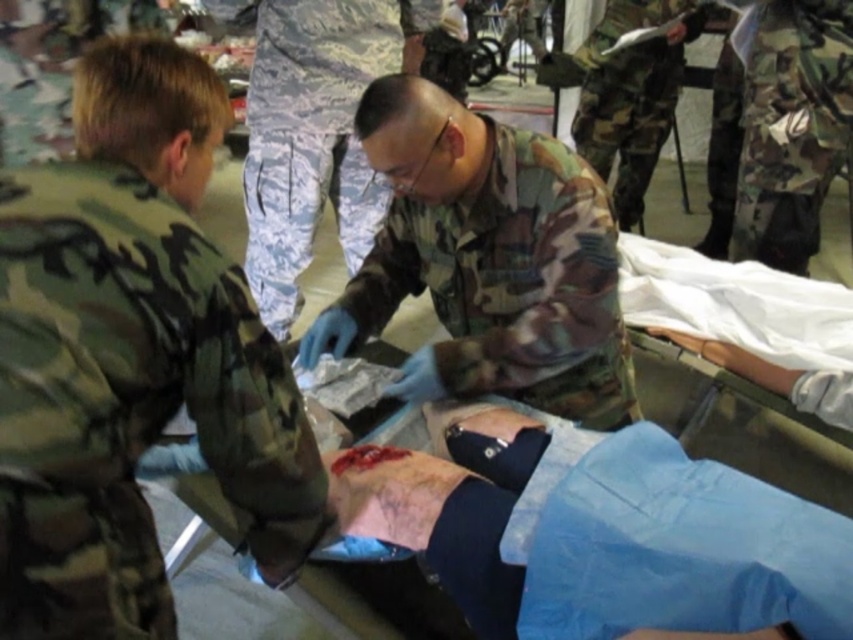
Between point (424, 349) and point (236, 6), which one is positioned behind?

Positioned behind is point (236, 6).

Who is taller, camouflage fabric at center or digital camouflage pants at center?

digital camouflage pants at center is taller.

This screenshot has width=853, height=640. What do you see at coordinates (486, 260) in the screenshot?
I see `camouflage fabric at center` at bounding box center [486, 260].

You are a GUI agent. You are given a task and a screenshot of the screen. Output one action in this format:
    pyautogui.click(x=<x>, y=<y>)
    Task: Click on the camouflage fabric at center
    This screenshot has height=640, width=853.
    Given the screenshot: What is the action you would take?
    pyautogui.click(x=486, y=260)

Can you confirm if camouflage fabric at left is positioned to the left of digital camouflage pants at center?

In fact, camouflage fabric at left is to the right of digital camouflage pants at center.

Consider the image. Measure the distance from camouflage fabric at left to digital camouflage pants at center.

A distance of 4.10 feet exists between camouflage fabric at left and digital camouflage pants at center.

Identify the location of camouflage fabric at left. The height and width of the screenshot is (640, 853). (131, 356).

Between digital camouflage pants at center and camouflage fabric uniform at upper center, which one appears on the left side from the viewer's perspective?

digital camouflage pants at center is more to the left.

The height and width of the screenshot is (640, 853). What do you see at coordinates (315, 132) in the screenshot?
I see `digital camouflage pants at center` at bounding box center [315, 132].

I want to click on digital camouflage pants at center, so click(315, 132).